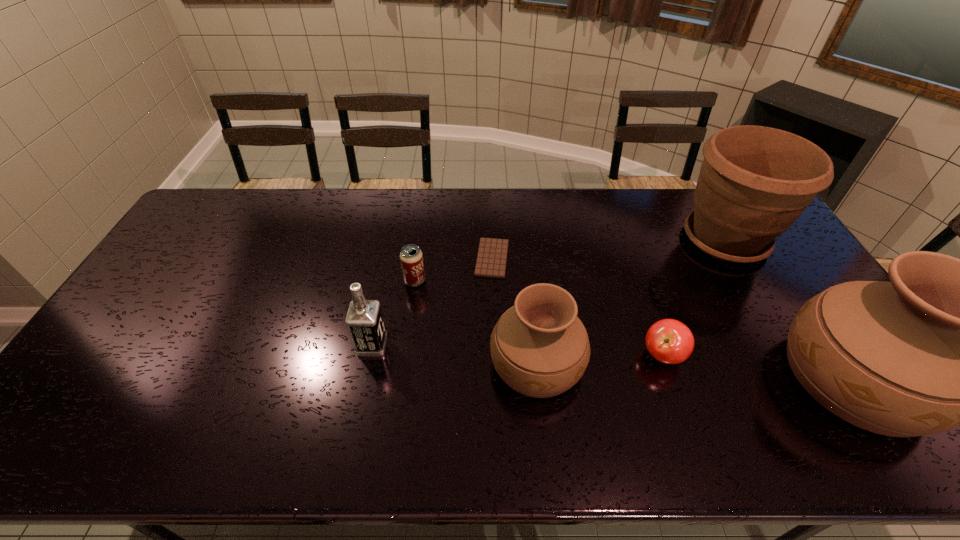
You are a GUI agent. You are given a task and a screenshot of the screen. Output one action in this format:
    pyautogui.click(x=<x>, y=<y>)
    Task: Click on the left urn
    The width and height of the screenshot is (960, 540).
    Given the screenshot: What is the action you would take?
    pyautogui.click(x=540, y=348)

Identify the location of the second object from left to right. (411, 258).

This screenshot has height=540, width=960. Identify the location of the shortest object. (492, 254).

This screenshot has width=960, height=540. In order to click on flowerpot in this screenshot , I will do `click(754, 182)`.

Identify the location of the third object from right to left. This screenshot has height=540, width=960. (669, 341).

This screenshot has height=540, width=960. In order to click on the leftmost object in this screenshot , I will do `click(364, 320)`.

The height and width of the screenshot is (540, 960). What are the coordinates of `vacant space positioned on the right of the shorter urn` in the screenshot? It's located at (707, 363).

At what (x,y) coordinates should I click in order to perform the action: click on vacant space situated on the right of the sixth object from right to left. Please return your answer as a coordinate pair (x, y). The height and width of the screenshot is (540, 960). Looking at the image, I should click on point(500,281).

Identify the location of free space located 0.270m on the right of the shortest object. The image size is (960, 540). [592, 258].

The image size is (960, 540). I want to click on blank space located 0.390m on the left of the flowerpot, so click(x=560, y=239).